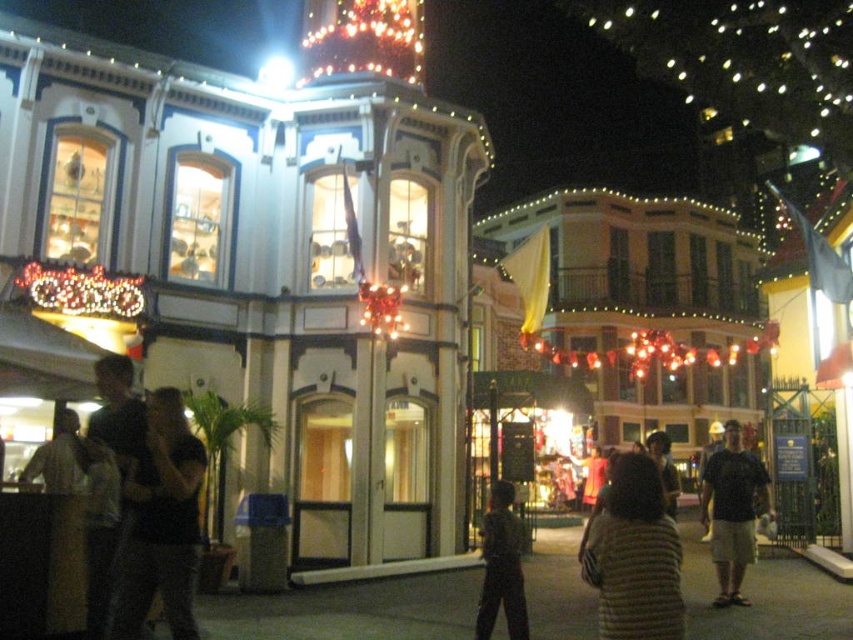
Who is shorter, striped fabric at center or dark gray shirt at left?

dark gray shirt at left

Is striped fabric at center further to the viewer compared to dark gray shirt at left?

No, striped fabric at center is closer to the viewer.

Is point (598, 572) positioned before point (61, 481)?

Yes, it is.

Locate an element on the screen. striped fabric at center is located at coordinates (634, 556).

The width and height of the screenshot is (853, 640). What do you see at coordinates (732, 509) in the screenshot?
I see `dark gray t-shirt at lower right` at bounding box center [732, 509].

Between dark gray t-shirt at lower right and dark gray pants at center, which one is positioned lower?

Positioned lower is dark gray t-shirt at lower right.

Between point (746, 529) and point (477, 632), which one is positioned behind?

Positioned behind is point (746, 529).

Identify the location of dark gray t-shirt at lower right. (732, 509).

Measure the distance between dark clothing at left and illuminated glass christmas lights at upper center.

dark clothing at left and illuminated glass christmas lights at upper center are 31.60 meters apart from each other.

Is dark clothing at left positioned before illuminated glass christmas lights at upper center?

Yes, it is.

Which is behind, point (154, 456) or point (367, 45)?

The point (367, 45) is behind.

Locate an element on the screen. dark clothing at left is located at coordinates (161, 525).